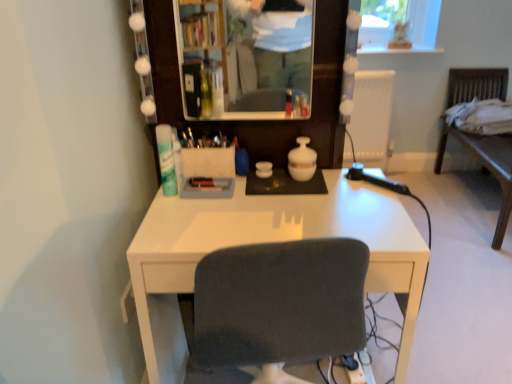
Question: Considering their positions, is matte glass mirror at upper center located in front of or behind white plastic radiator at upper right?

Choices:
 (A) behind
 (B) front

Answer: (B)

Question: Considering the positions of point (257, 28) and point (376, 132), is point (257, 28) closer or farther from the camera than point (376, 132)?

Choices:
 (A) farther
 (B) closer

Answer: (B)

Question: Which object is positioned farthest from the white glossy desk at center?

Choices:
 (A) matte glass mirror at upper center
 (B) white matte deodorant at left
 (C) wooden chair at right
 (D) white plastic radiator at upper right

Answer: (D)

Question: Based on their relative distances, which object is nearer to the white glossy desk at center?

Choices:
 (A) wooden chair at right
 (B) white matte deodorant at left
 (C) matte glass mirror at upper center
 (D) white plastic radiator at upper right

Answer: (B)